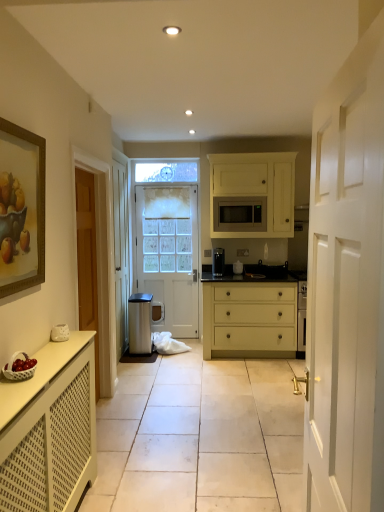
Describe the element at coordinates (255, 319) in the screenshot. The image size is (384, 512). I see `white matte drawer at center` at that location.

Identify the location of white glossy radiator at lower left. (200, 437).

I want to click on satin silver microwave at center, so click(x=240, y=214).

Looking at this image, measure the distance between point (224, 197) and camera.

15.72 feet.

This screenshot has height=512, width=384. What do you see at coordinates (346, 287) in the screenshot?
I see `white glossy door at right, which is counted as the second door, starting from the left` at bounding box center [346, 287].

What do you see at coordinates (266, 271) in the screenshot? I see `black matte stove at center, the second appliance positioned from the left` at bounding box center [266, 271].

You are a GUI agent. You are given a task and a screenshot of the screen. Output one action in this format:
    pyautogui.click(x=<x>, y=<y>)
    Task: Click on the white matte drawer at center
    This screenshot has height=512, width=384.
    Given the screenshot: What is the action you would take?
    pyautogui.click(x=255, y=319)

In the scene shown: From the image's perspective, is white textured door at center, placed as the second door when sorted from right to left, located above or below white glossy door at right, the 1th door in the right-to-left sequence?

Based on their image positions, white textured door at center, placed as the second door when sorted from right to left, is located above white glossy door at right, the 1th door in the right-to-left sequence.

Is white textured door at center, the 1th door in the back-to-front sequence, at the left side of white glossy door at right, the first door in the front-to-back sequence?

Correct, you'll find white textured door at center, the 1th door in the back-to-front sequence, to the left of white glossy door at right, the first door in the front-to-back sequence.

Is white textured door at center, the 1th door from the left, spatially inside white glossy door at right, which is counted as the second door, starting from the left, or outside of it?

white textured door at center, the 1th door from the left, exists outside the volume of white glossy door at right, which is counted as the second door, starting from the left.

From the image's perspective, which one is positioned higher, satin black coffee maker at center, the second appliance in the right-to-left sequence, or white matte drawer at center?

satin black coffee maker at center, the second appliance in the right-to-left sequence.

Is satin black coffee maker at center, the second appliance in the right-to-left sequence, shorter than white matte drawer at center?

Yes.

Is satin black coffee maker at center, arranged as the 1th appliance when viewed from the left, in front of or behind white matte drawer at center in the image?

satin black coffee maker at center, arranged as the 1th appliance when viewed from the left, is behind white matte drawer at center.

Which is correct: satin black coffee maker at center, the second appliance in the right-to-left sequence, is inside white matte drawer at center, or outside of it?

satin black coffee maker at center, the second appliance in the right-to-left sequence, exists entirely within white matte drawer at center.

Considering their positions, is white textured door at center, which ranks as the 2th door in front-to-back order, located in front of or behind white wicker basket at lower left?

Visually, white textured door at center, which ranks as the 2th door in front-to-back order, is located behind white wicker basket at lower left.

Considering the relative sizes of white textured door at center, the 1th door in the back-to-front sequence, and white wicker basket at lower left in the image provided, is white textured door at center, the 1th door in the back-to-front sequence, shorter than white wicker basket at lower left?

No, white textured door at center, the 1th door in the back-to-front sequence, is not shorter than white wicker basket at lower left.

From the image's perspective, is white textured door at center, which ranks as the 2th door in front-to-back order, located above or below white wicker basket at lower left?

white textured door at center, which ranks as the 2th door in front-to-back order, is above white wicker basket at lower left.

From a real-world perspective, which object rests below the other?

From a 3D spatial view, white wicker basket at lower left is below.

From a real-world perspective, is black matte stove at center, which is the 1th appliance in right-to-left order, physically located above or below white textured door at center, which ranks as the 2th door in front-to-back order?

black matte stove at center, which is the 1th appliance in right-to-left order, is situated lower than white textured door at center, which ranks as the 2th door in front-to-back order, in the real world.

Between point (257, 264) and point (167, 308), which one is positioned in front?

Positioned in front is point (257, 264).

In the scene shown: From the image's perspective, which is above, black matte stove at center, the second appliance positioned from the left, or white textured door at center, the 1th door from the left?

white textured door at center, the 1th door from the left, appears higher in the image.

Can you confirm if black matte stove at center, which is the 1th appliance in right-to-left order, is shorter than white textured door at center, the 1th door in the back-to-front sequence?

Yes, black matte stove at center, which is the 1th appliance in right-to-left order, is shorter than white textured door at center, the 1th door in the back-to-front sequence.

Is white glossy door at right, which is counted as the second door, starting from the left, in front of or behind wooden framed painting at left in the image?

Visually, white glossy door at right, which is counted as the second door, starting from the left, is located in front of wooden framed painting at left.

From the image's perspective, which one is positioned higher, white glossy door at right, which is the second door from back to front, or wooden framed painting at left?

wooden framed painting at left is shown above in the image.

Would you say white glossy door at right, the 1th door in the right-to-left sequence, is to the left or to the right of wooden framed painting at left in the picture?

white glossy door at right, the 1th door in the right-to-left sequence, is positioned on wooden framed painting at left's right side.

Can you tell me how much white matte cabinet at center, the 2th cabinetry when ordered from bottom to top, and white glossy door at right, the 1th door in the right-to-left sequence, differ in facing direction?

94.9 degrees.

From a real-world perspective, relative to white glossy door at right, which is counted as the second door, starting from the left, is white matte cabinet at center, which is the 2th cabinetry in left-to-right order, vertically above or below?

Clearly, from a real-world perspective, white matte cabinet at center, which is the 2th cabinetry in left-to-right order, is above white glossy door at right, which is counted as the second door, starting from the left.

Does white matte cabinet at center, placed as the 1th cabinetry when sorted from back to front, have a lesser height compared to white glossy door at right, which is counted as the second door, starting from the left?

Yes, white matte cabinet at center, placed as the 1th cabinetry when sorted from back to front, is shorter than white glossy door at right, which is counted as the second door, starting from the left.

In the scene shown: Does white matte cabinet at center, the 2th cabinetry when ordered from bottom to top, come behind white glossy door at right, the first door in the front-to-back sequence?

Yes, white matte cabinet at center, the 2th cabinetry when ordered from bottom to top, is further from the camera.

Which of these two, black matte stove at center, which is the 1th appliance in right-to-left order, or white matte drawer at center, stands taller?

Standing taller between the two is white matte drawer at center.

From a real-world perspective, is black matte stove at center, the second appliance positioned from the left, physically located above or below white matte drawer at center?

In terms of real-world spatial position, black matte stove at center, the second appliance positioned from the left, is above white matte drawer at center.

What are the coordinates of `door below the white textured door at center, placed as the second door when sorted from right to left (from the image's perspective)` in the screenshot? It's located at (346, 287).

Where is `drawer that is on the right side of satin black coffee maker at center, the second appliance in the right-to-left sequence`? The height and width of the screenshot is (512, 384). drawer that is on the right side of satin black coffee maker at center, the second appliance in the right-to-left sequence is located at coordinates (255, 319).

Estimate the real-world distances between objects in this image. Which object is further from satin silver microwave at center, white matte cabinet at center, the 2th cabinetry when ordered from bottom to top, or white textured door at center, placed as the second door when sorted from right to left?

white textured door at center, placed as the second door when sorted from right to left, lies further to satin silver microwave at center than the other object.

Which object lies nearer to the anchor point white matte drawer at center, white glossy radiator at lower left or white textured door at center, placed as the second door when sorted from right to left?

Among the two, white textured door at center, placed as the second door when sorted from right to left, is located nearer to white matte drawer at center.

When comparing their distances from white matte cabinet at lower left, positioned as the second cabinetry in back-to-front order, does satin silver microwave at center or white glossy door at right, the first door in the front-to-back sequence, seem further?

Among the two, satin silver microwave at center is located further to white matte cabinet at lower left, positioned as the second cabinetry in back-to-front order.

Considering their positions, is white wicker basket at lower left positioned closer to white matte cabinet at lower left, positioned as the first cabinetry in front-to-back order, than satin black coffee maker at center, arranged as the 1th appliance when viewed from the left?

Based on the image, white wicker basket at lower left appears to be nearer to white matte cabinet at lower left, positioned as the first cabinetry in front-to-back order.

Looking at the image, which one is located further to white glossy radiator at lower left, white glossy door at right, the first door in the front-to-back sequence, or satin black coffee maker at center, arranged as the 1th appliance when viewed from the left?

Among the two, satin black coffee maker at center, arranged as the 1th appliance when viewed from the left, is located further to white glossy radiator at lower left.

Looking at the image, which one is located closer to white textured door at center, which ranks as the 2th door in front-to-back order, satin silver microwave at center or white wicker basket at lower left?

satin silver microwave at center is closer to white textured door at center, which ranks as the 2th door in front-to-back order.

Looking at the image, which one is located closer to black matte stove at center, the second appliance positioned from the left, white glossy radiator at lower left or white matte drawer at center?

white matte drawer at center lies closer to black matte stove at center, the second appliance positioned from the left, than the other object.

Based on the photo, based on their spatial positions, is black matte stove at center, the second appliance positioned from the left, or white matte cabinet at lower left, placed as the second cabinetry when sorted from right to left, further from wooden framed painting at left?

black matte stove at center, the second appliance positioned from the left.

You are a GUI agent. You are given a task and a screenshot of the screen. Output one action in this format:
    pyautogui.click(x=<x>, y=<y>)
    Task: Click on the drawer located between white wicker basket at lower left and white matte cabinet at center, the 2th cabinetry when ordered from bottom to top, in the depth direction
    The width and height of the screenshot is (384, 512).
    Given the screenshot: What is the action you would take?
    pyautogui.click(x=255, y=319)

Find the location of a particular element. drawer between white matte cabinet at lower left, placed as the second cabinetry when sorted from right to left, and white textured door at center, the 1th door in the back-to-front sequence, in the front-back direction is located at coordinates (255, 319).

You are a GUI agent. You are given a task and a screenshot of the screen. Output one action in this format:
    pyautogui.click(x=<x>, y=<y>)
    Task: Click on the cabinetry between white glossy radiator at lower left and satin black coffee maker at center, the second appliance in the right-to-left sequence, from front to back
    The height and width of the screenshot is (512, 384).
    Given the screenshot: What is the action you would take?
    coord(252,195)

Image resolution: width=384 pixels, height=512 pixels. What are the coordinates of `drawer between white glossy door at right, the first door in the front-to-back sequence, and black matte stove at center, which is the 1th appliance in right-to-left order, in the front-back direction` in the screenshot? It's located at (255, 319).